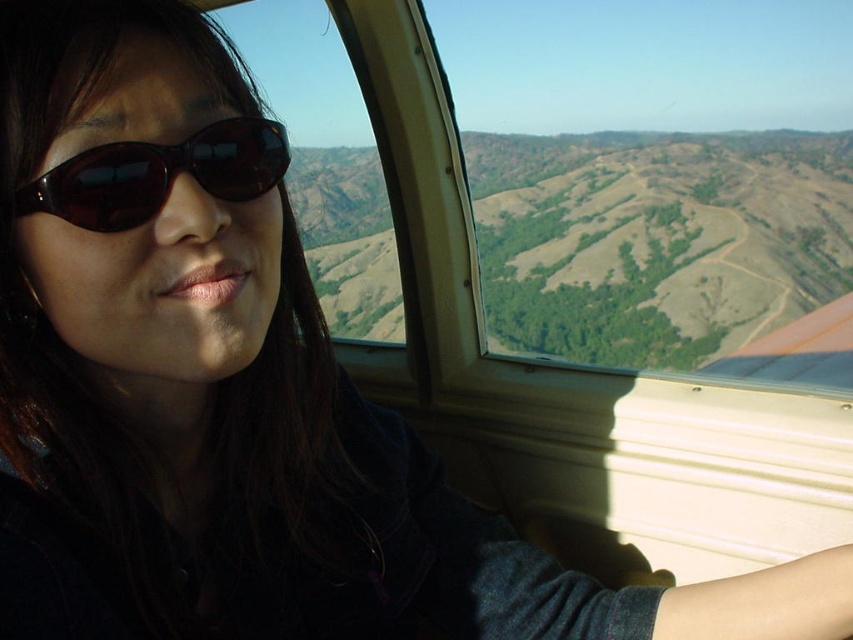
Question: Does transparent glass window at upper center have a greater width compared to sunglasses at left?

Choices:
 (A) no
 (B) yes

Answer: (B)

Question: Among these objects, which one is nearest to the camera?

Choices:
 (A) transparent glass window at upper center
 (B) sunglasses at left

Answer: (B)

Question: Observing the image, what is the correct spatial positioning of transparent glass window at upper center in reference to sunglasses at left?

Choices:
 (A) below
 (B) above

Answer: (B)

Question: Where is transparent glass window at upper center located in relation to sunglasses at left in the image?

Choices:
 (A) left
 (B) right

Answer: (B)

Question: Among these objects, which one is farthest from the camera?

Choices:
 (A) sunglasses at left
 (B) transparent glass window at upper center

Answer: (B)

Question: Which point is closer to the camera?

Choices:
 (A) sunglasses at left
 (B) transparent glass window at upper center

Answer: (A)